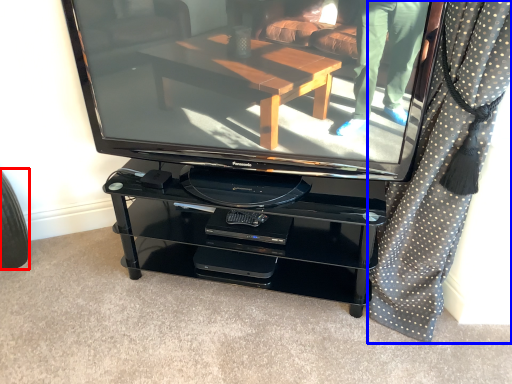
Question: Which of the following is the closest to the observer, tire (highlighted by a red box) or curtain (highlighted by a blue box)?

Choices:
 (A) tire
 (B) curtain

Answer: (B)